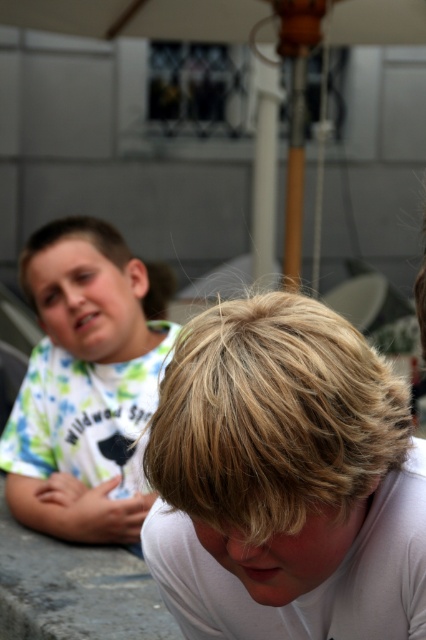
You are standing in a park and see the blonde hair at lower center. If you have a 36 inch long stick, can you reach it without moving closer?

The blonde hair at lower center is 37.65 inches from viewer, so the 36 inch stick is too short to reach it. You need to move closer.